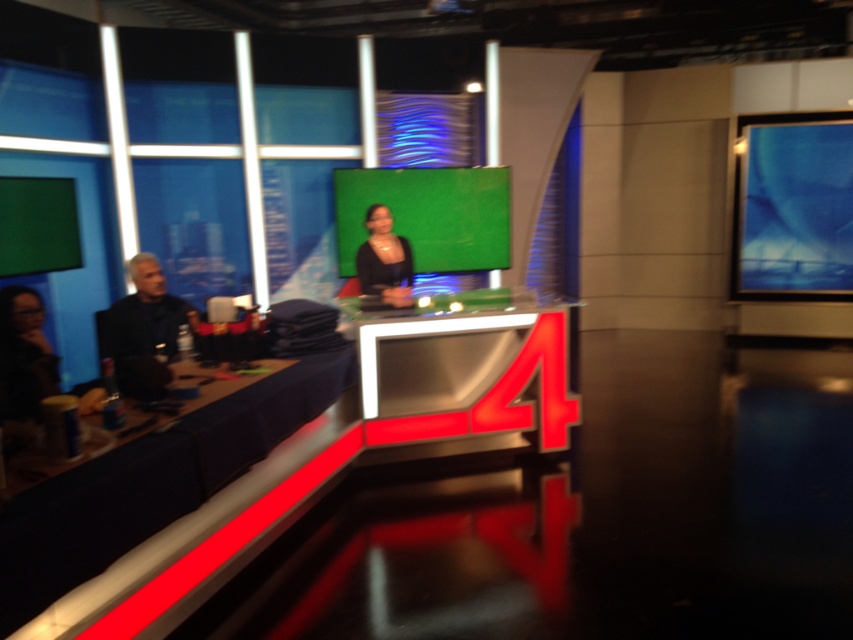
Is point (241, 394) behind point (427, 403)?

No, (241, 394) is closer to viewer.

Which of these two, metallic table at left or metallic reflective table at center, stands shorter?

Standing shorter between the two is metallic table at left.

At what (x,y) coordinates should I click in order to perform the action: click on metallic table at left. Please return your answer as a coordinate pair (x, y). Looking at the image, I should click on (149, 483).

Can you confirm if dark blue shirt at left is positioned above black glossy dress at center?

Actually, dark blue shirt at left is below black glossy dress at center.

Locate an element on the screen. dark blue shirt at left is located at coordinates (144, 330).

This screenshot has height=640, width=853. I want to click on dark blue shirt at left, so click(144, 330).

Who is higher up, matte blue screen at upper right or dark blue shirt at left?

Positioned higher is matte blue screen at upper right.

Is matte blue screen at upper right below dark blue shirt at left?

No.

Is point (740, 141) farther from camera compared to point (119, 312)?

Yes, it is.

Where is `matte blue screen at upper right`? matte blue screen at upper right is located at coordinates (792, 208).